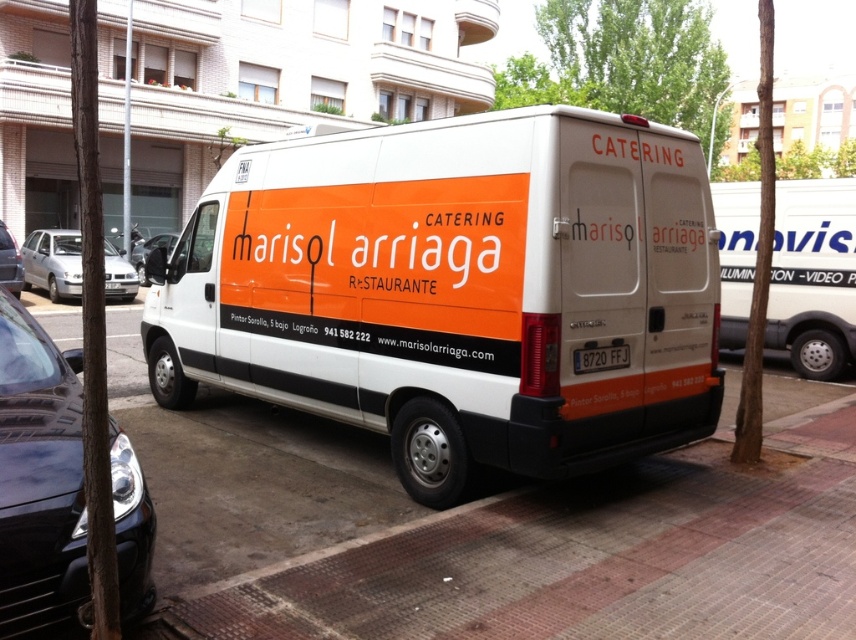
You are standing in front of the Marisol Arriaga Catering van and notice two points marked on its side. Which point is closer to you, point [330,593] or point [138,248]?

Point [330,593] is closer to the viewer than point [138,248].

You are a pedestrian standing on the sidewalk and see both the silver metallic sedan at left and the matte black van at center. Which vehicle is closer to you?

The silver metallic sedan at left is closer to you because it is positioned further to the viewer than the matte black van at center, meaning it appears nearer in the image.